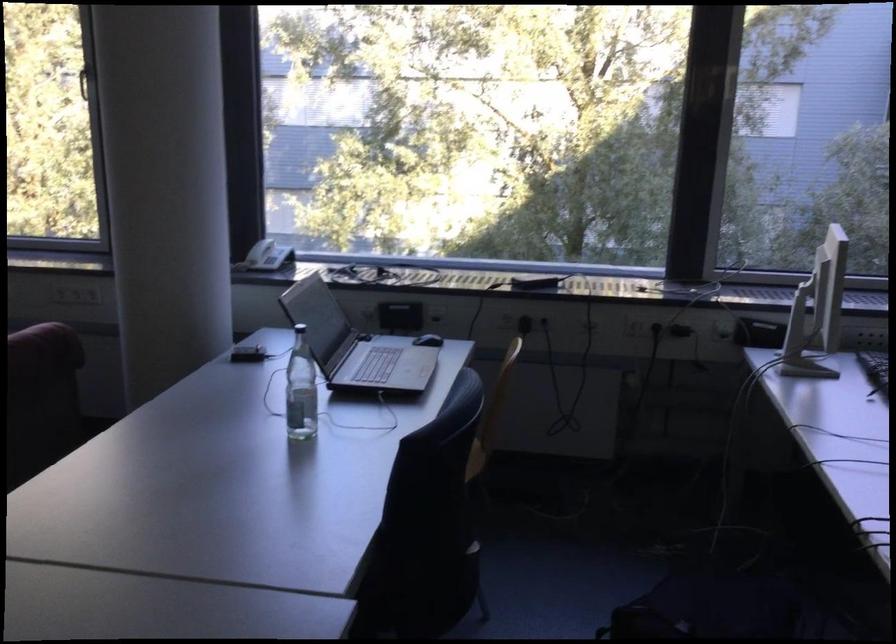
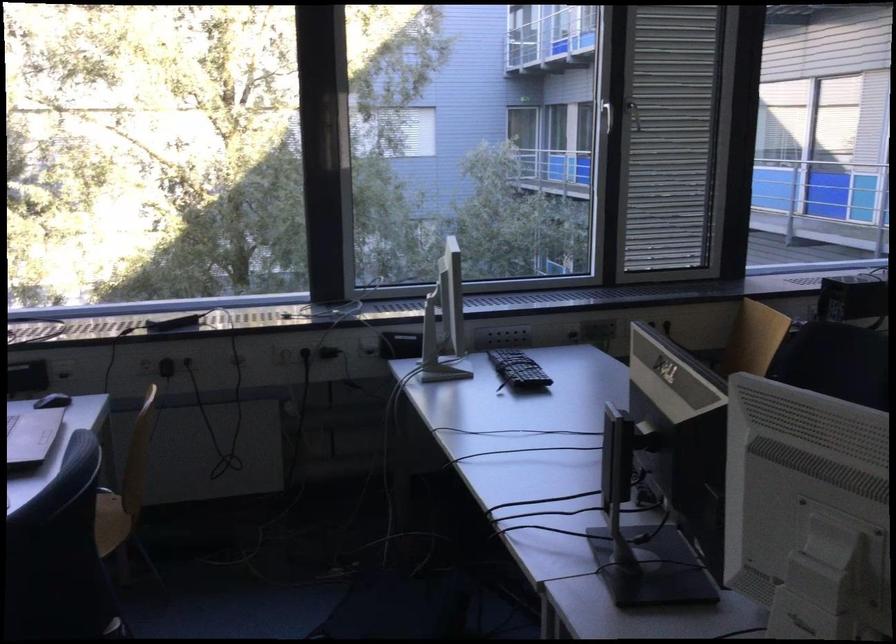
Question: The camera is either moving clockwise (left) or counter-clockwise (right) around the object. The first image is from the beginning of the video and the second image is from the end. Is the camera moving left or right when shooting the video?

Choices:
 (A) Left
 (B) Right

Answer: (A)